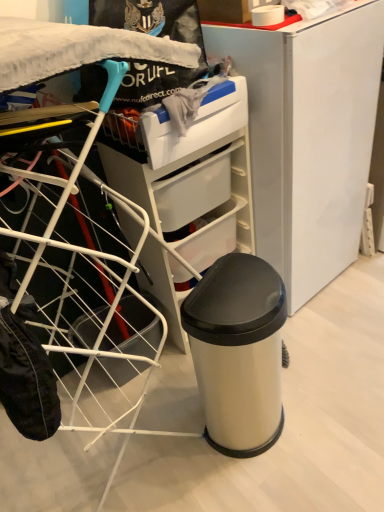
Question: Is satin white laundry basket at left far from satin white fridge at center?

Choices:
 (A) no
 (B) yes

Answer: (A)

Question: Is satin white fridge at center a part of satin white laundry basket at left?

Choices:
 (A) no
 (B) yes

Answer: (A)

Question: Is satin white laundry basket at left bigger than satin white fridge at center?

Choices:
 (A) yes
 (B) no

Answer: (A)

Question: Is satin white laundry basket at left outside satin white fridge at center?

Choices:
 (A) no
 (B) yes

Answer: (B)

Question: Is satin white laundry basket at left shorter than satin white fridge at center?

Choices:
 (A) yes
 (B) no

Answer: (B)

Question: From a real-world perspective, is satin silver trash can at center positioned above or below satin white laundry basket at left?

Choices:
 (A) below
 (B) above

Answer: (A)

Question: Considering the positions of satin silver trash can at center and satin white laundry basket at left in the image, is satin silver trash can at center bigger or smaller than satin white laundry basket at left?

Choices:
 (A) small
 (B) big

Answer: (A)

Question: Looking at their shapes, would you say satin silver trash can at center is wider or thinner than satin white laundry basket at left?

Choices:
 (A) wide
 (B) thin

Answer: (B)

Question: Would you say satin silver trash can at center is to the left or to the right of satin white laundry basket at left in the picture?

Choices:
 (A) right
 (B) left

Answer: (A)

Question: Visually, is satin silver trash can at center positioned to the left or to the right of satin white fridge at center?

Choices:
 (A) right
 (B) left

Answer: (B)

Question: In the image, is satin silver trash can at center positioned in front of or behind satin white fridge at center?

Choices:
 (A) front
 (B) behind

Answer: (A)

Question: From a real-world perspective, is satin silver trash can at center positioned above or below satin white fridge at center?

Choices:
 (A) above
 (B) below

Answer: (B)

Question: From their relative heights in the image, would you say satin silver trash can at center is taller or shorter than satin white fridge at center?

Choices:
 (A) tall
 (B) short

Answer: (B)

Question: Based on their positions, is satin white laundry basket at left located to the left or right of satin silver trash can at center?

Choices:
 (A) left
 (B) right

Answer: (A)

Question: Is satin white laundry basket at left taller or shorter than satin silver trash can at center?

Choices:
 (A) tall
 (B) short

Answer: (A)